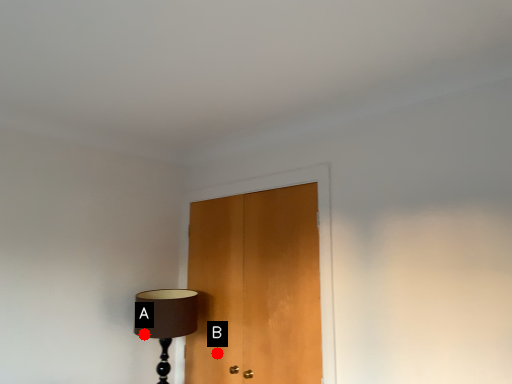
Question: Two points are circled on the image, labeled by A and B beside each circle. Which of the following is the closest to the observer?

Choices:
 (A) A is closer
 (B) B is closer

Answer: (A)